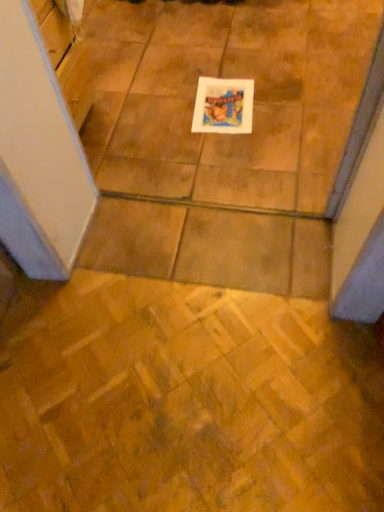
Locate an element on the screen. free space to the left of white paper at center is located at coordinates (167, 113).